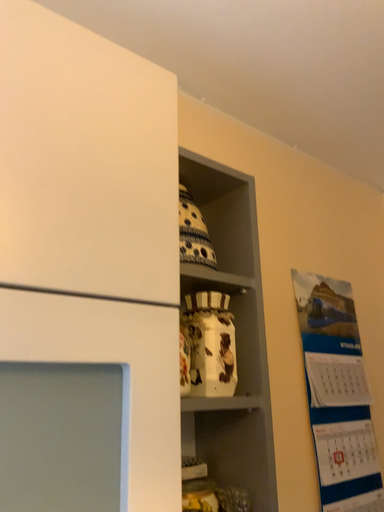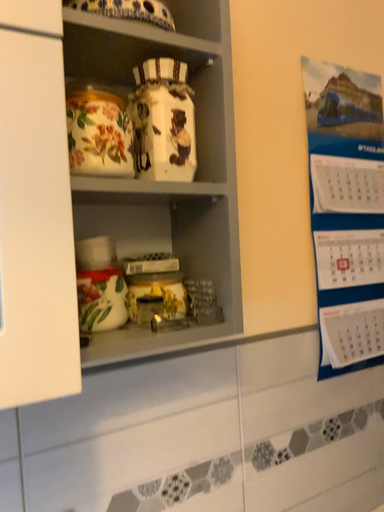
Question: How did the camera likely rotate when shooting the video?

Choices:
 (A) rotated upward
 (B) rotated downward

Answer: (B)